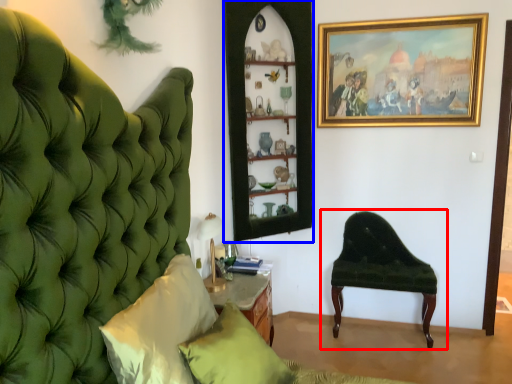
Question: Which object appears farthest to the camera in this image, chair (highlighted by a red box) or shelf (highlighted by a blue box)?

Choices:
 (A) chair
 (B) shelf

Answer: (A)